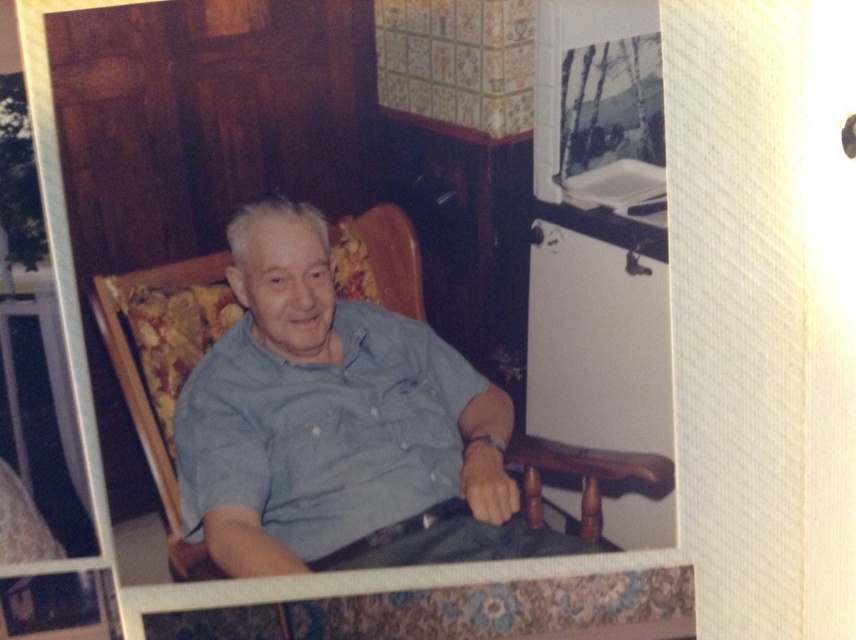
Who is lower down, blue cotton shirt at center or dark green fabric at lower center?

dark green fabric at lower center

Locate an element on the screen. The width and height of the screenshot is (856, 640). blue cotton shirt at center is located at coordinates (334, 424).

Which is behind, point (581, 548) or point (456, 516)?

The point (456, 516) is more distant.

The height and width of the screenshot is (640, 856). Identify the location of blue cotton shirt at center. click(334, 424).